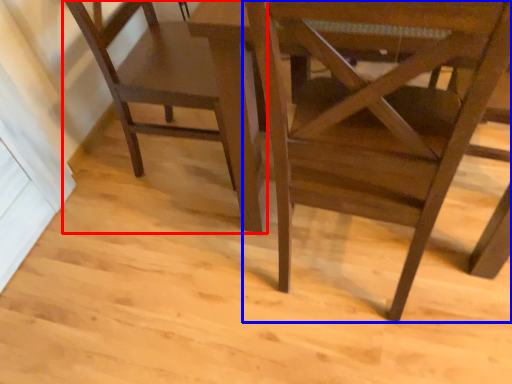
Question: Which object is closer to the camera taking this photo, chair (highlighted by a red box) or chair (highlighted by a blue box)?

Choices:
 (A) chair
 (B) chair

Answer: (B)